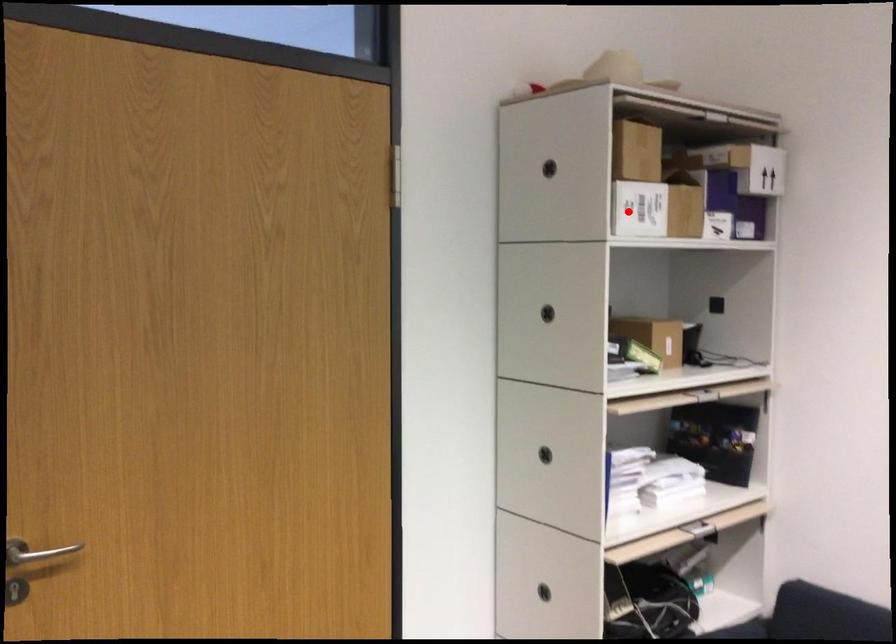
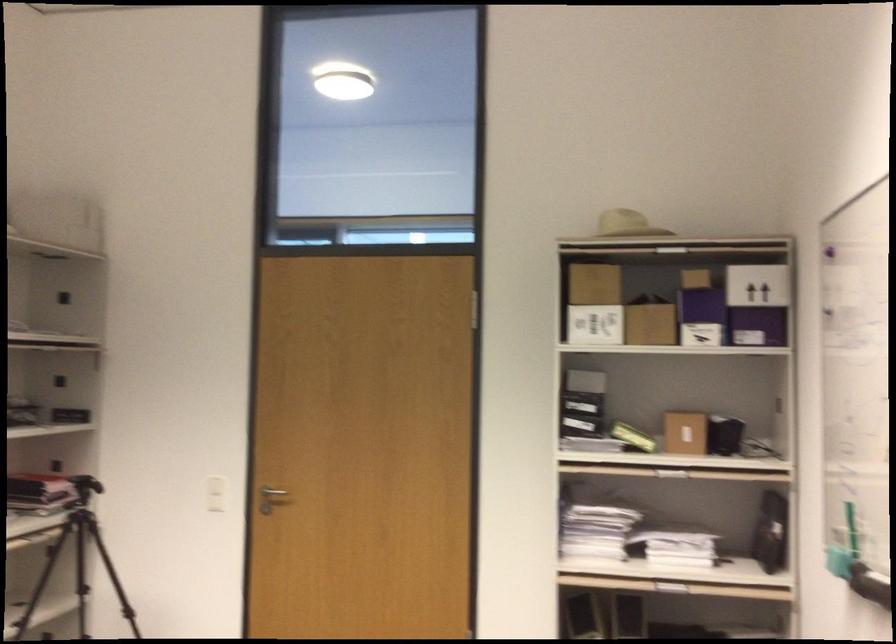
Locate, in the second image, the point that corresponds to the highlighted location in the first image.

(595, 325)